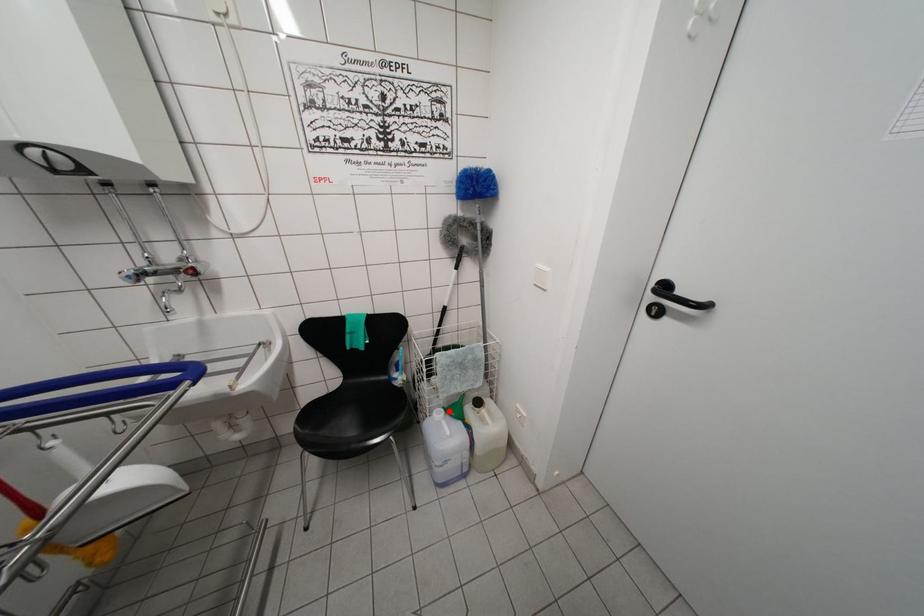
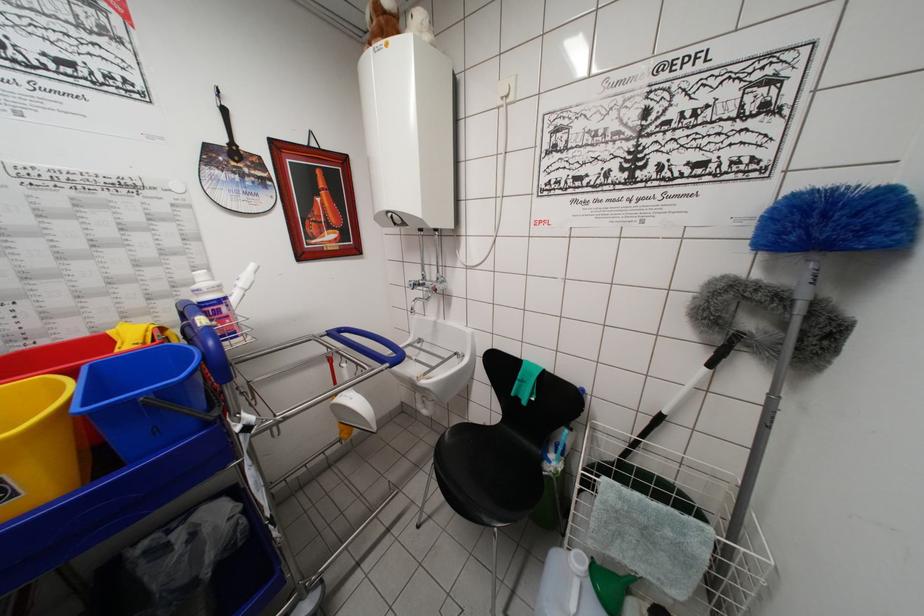
Question: I am providing you with two images of the same scene from different viewpoints. A red point is shown in image1. For the corresponding object point in image2, is it positioned nearer or farther from the camera?

Choices:
 (A) Nearer
 (B) Farther

Answer: (A)